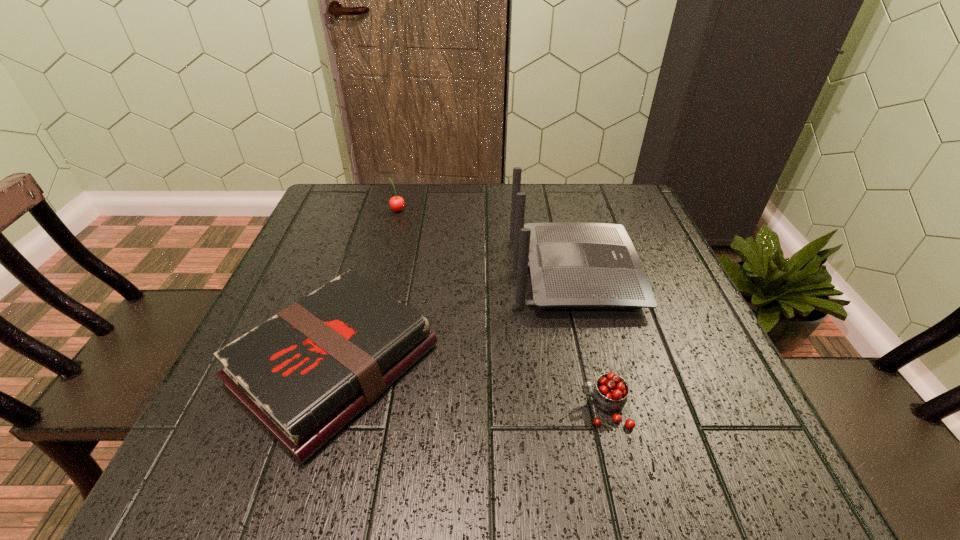
This screenshot has height=540, width=960. Find the location of `free point located on the handle side of the nearer cherry`. free point located on the handle side of the nearer cherry is located at coordinates (508, 408).

In order to click on object that is at the far edge in this screenshot , I will do `click(397, 203)`.

The image size is (960, 540). What are the coordinates of `object that is positioned at the near edge` in the screenshot? It's located at (304, 374).

This screenshot has height=540, width=960. I want to click on object present at the left edge, so click(304, 374).

The width and height of the screenshot is (960, 540). I want to click on object present at the right edge, so click(x=573, y=265).

Identify the location of object at the near left corner. The image size is (960, 540). (304, 374).

Where is `free region at the far edge of the desktop`? free region at the far edge of the desktop is located at coordinates tap(511, 214).

In the image, there is a desktop. At what (x,y) coordinates should I click in order to perform the action: click on free region at the left edge. Please return your answer as a coordinate pair (x, y). Looking at the image, I should click on (302, 282).

In the image, there is a desktop. At what (x,y) coordinates should I click in order to perform the action: click on vacant space at the right edge. Please return your answer as a coordinate pair (x, y). This screenshot has height=540, width=960. Looking at the image, I should click on (719, 408).

In the image, there is a desktop. At what (x,y) coordinates should I click in order to perform the action: click on free region at the far left corner. Please return your answer as a coordinate pair (x, y). Image resolution: width=960 pixels, height=540 pixels. Looking at the image, I should click on (342, 185).